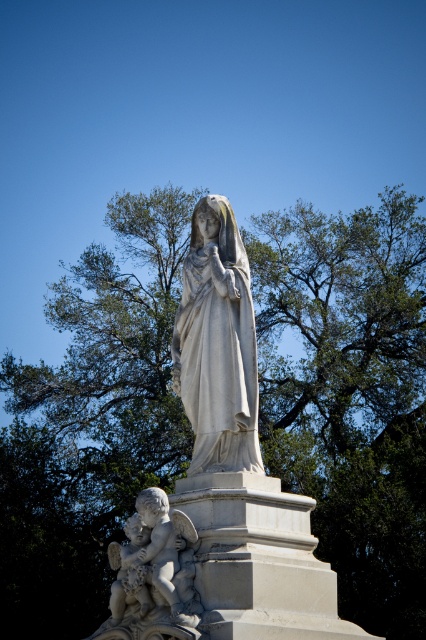
Question: Among these objects, which one is farthest from the camera?

Choices:
 (A) white marble cherub at lower left
 (B) smooth stone cherub at lower left

Answer: (B)

Question: From the image, what is the correct spatial relationship of green leafy tree at upper center in relation to white marble statue at center?

Choices:
 (A) below
 (B) above

Answer: (A)

Question: Which of the following is the closest to the observer?

Choices:
 (A) smooth stone cherub at lower left
 (B) green leafy tree at upper center
 (C) white marble statue at center
 (D) white marble cherub at lower left

Answer: (D)

Question: Does white marble statue at center have a smaller size compared to white marble cherub at lower left?

Choices:
 (A) no
 (B) yes

Answer: (A)

Question: Which point appears closest to the camera in this image?

Choices:
 (A) (144, 628)
 (B) (204, 454)
 (C) (140, 612)

Answer: (A)

Question: Can you confirm if green leafy tree at upper center is bigger than white marble statue at center?

Choices:
 (A) yes
 (B) no

Answer: (A)